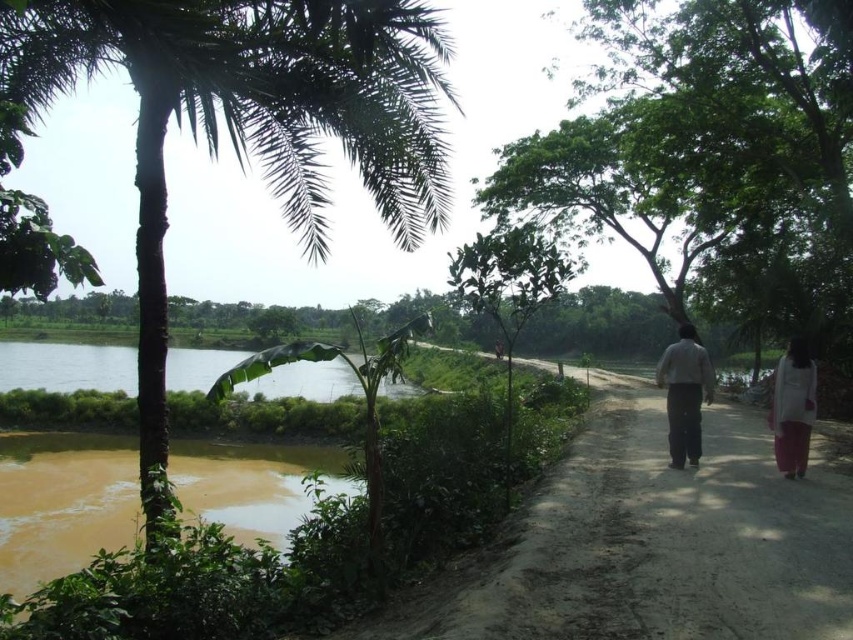
You are a traveler carrying a backpack and standing on the dirt path between the green leafy tree at center and the white cotton dress at right. You want to pass through the narrowest point between them. Can you fit through if your backpack adds 30 cm to your width?

The green leafy tree at center is wider than the white cotton dress at right. However, the exact width difference isn

You are a traveler walking along the dirt path in the rural scene. You notice two items at the right side of the path. Which one is taller between the light gray cotton pants at right and the white cotton dress at right?

The light gray cotton pants at right is taller than the white cotton dress at right.

From the picture: You are standing on the dirt path between the green leafy palm tree at left and the light gray cotton pants at right. If you look upward, which object will you see first?

The green leafy palm tree at left will be seen first when looking upward because it is positioned above the light gray cotton pants at right.